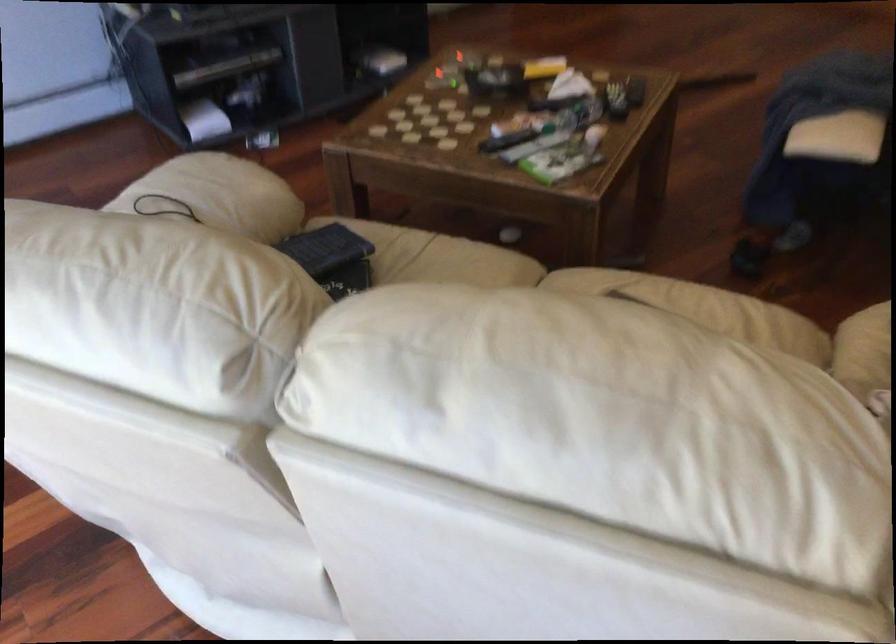
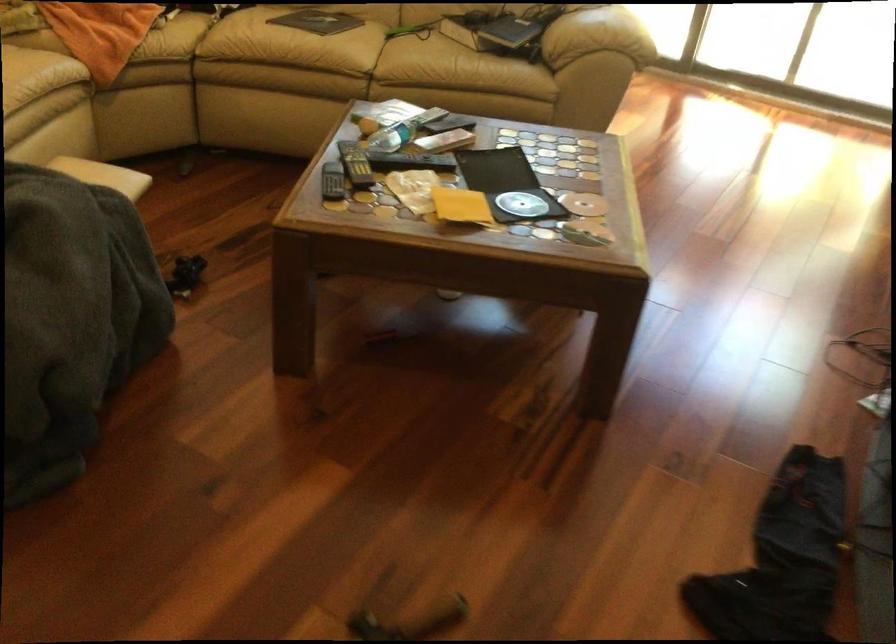
In the second image, find the point that corresponds to (x=633, y=82) in the first image.

(332, 182)